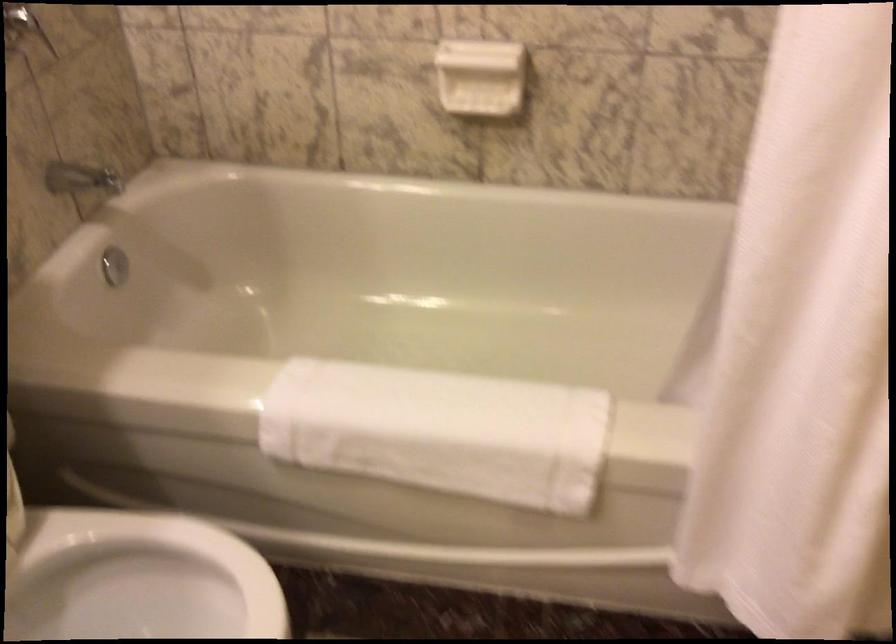
Locate an element on the screen. This screenshot has width=896, height=644. faucet diverter pin is located at coordinates (115, 266).